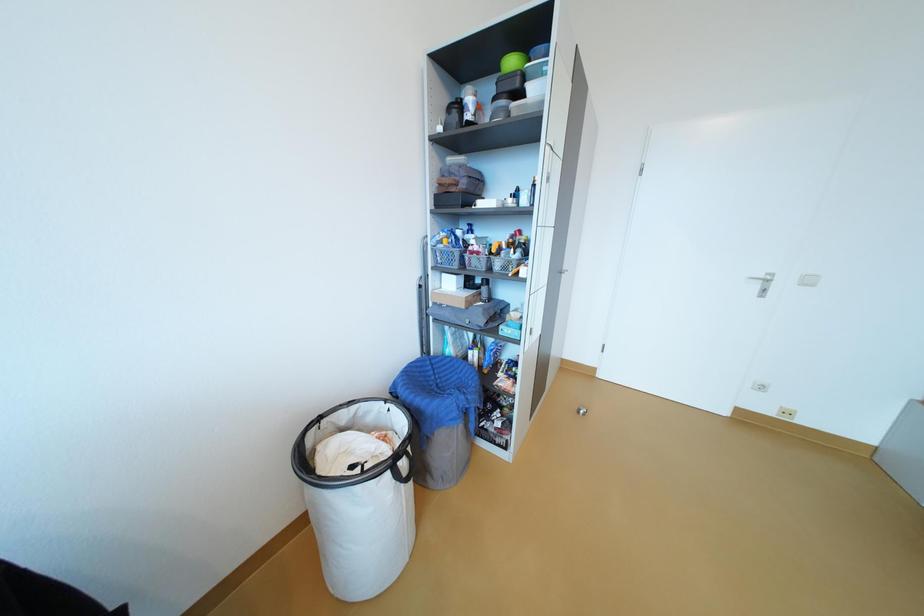
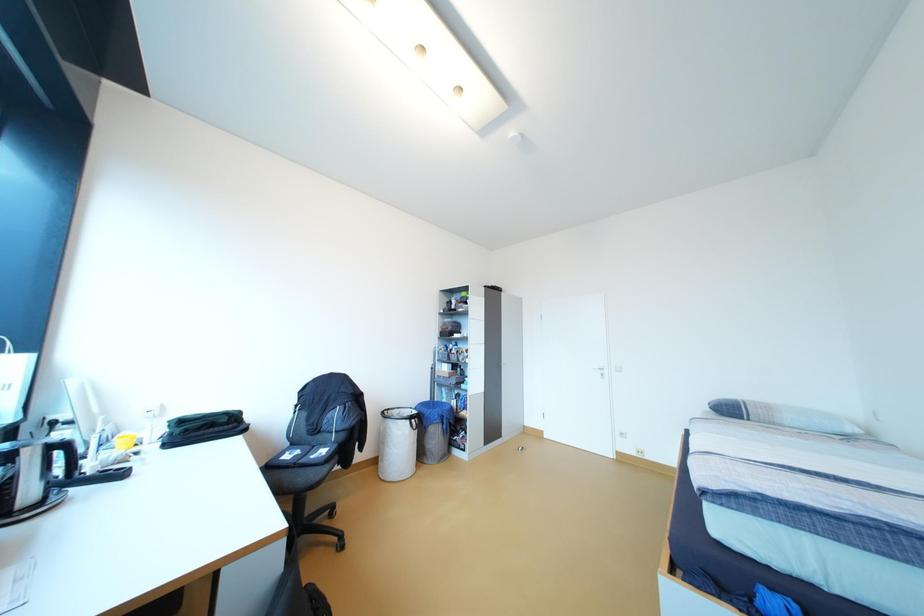
What movement of the cameraman would produce the second image?

The cameraman walked toward right, backward.